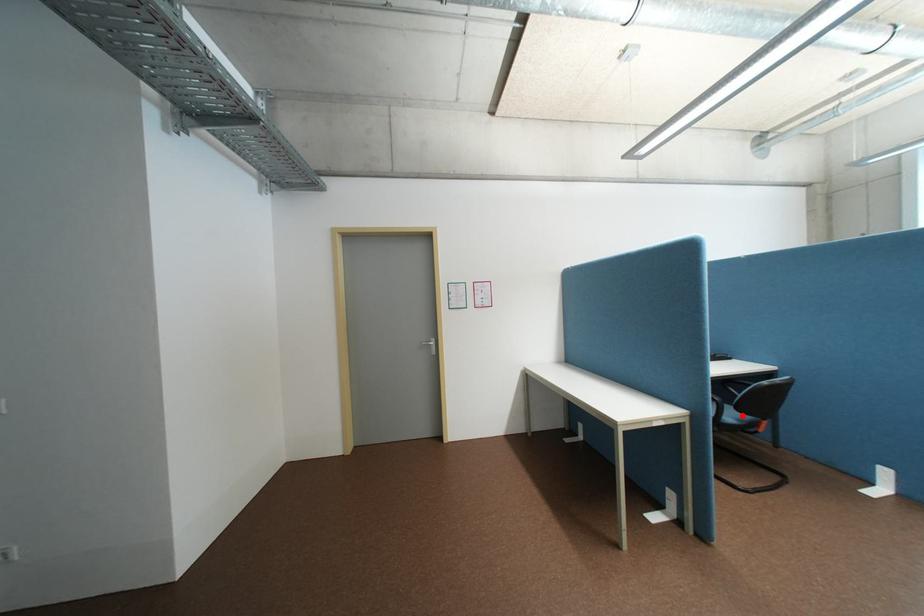
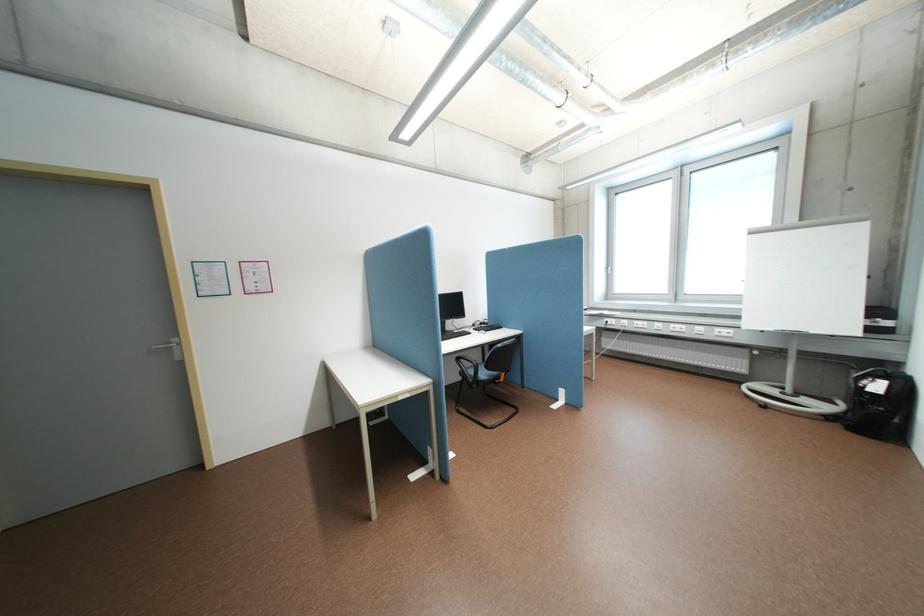
In the second image, find the point that corresponds to the highlighted location in the first image.

(494, 374)